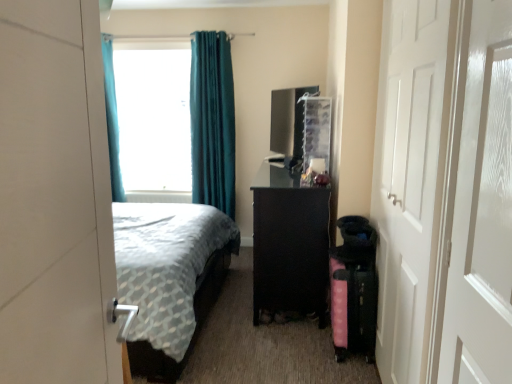
Describe the element at coordinates (154, 118) in the screenshot. I see `blue fabric curtain at upper center` at that location.

Find the location of a particular element. transparent frosted glass screen door at right is located at coordinates (482, 228).

The width and height of the screenshot is (512, 384). What are the coordinates of `teal velvet curtain at upper center, the 1th curtain viewed from the right` in the screenshot? It's located at (212, 121).

Image resolution: width=512 pixels, height=384 pixels. Describe the element at coordinates (444, 192) in the screenshot. I see `white matte door at right, which ranks as the 1th door in right-to-left order` at that location.

What is the approximate width of white glossy door at left, acting as the 2th door starting from the back?

The width of white glossy door at left, acting as the 2th door starting from the back, is 4.57 inches.

The height and width of the screenshot is (384, 512). I want to click on blue fabric curtain at upper center, so click(x=154, y=118).

From a real-world perspective, between pink fabric suitcase at lower right and blue fabric curtain at upper center, who is vertically lower?

From a 3D spatial view, pink fabric suitcase at lower right is below.

At what (x,y) coordinates should I click in order to perform the action: click on luggage located below the blue fabric curtain at upper center (from the image's perspective). Please return your answer as a coordinate pair (x, y). Looking at the image, I should click on (353, 301).

Which object is closer to the camera taking this photo, pink fabric suitcase at lower right or blue fabric curtain at upper center?

pink fabric suitcase at lower right is closer to the camera.

Which point is more forward, (369, 259) or (125, 139)?

The point (369, 259) is more forward.

Can you confirm if black glossy vanity at center is taller than transparent frosted glass screen door at right?

No.

From the image's perspective, which one is positioned higher, black glossy vanity at center or transparent frosted glass screen door at right?

From the image's view, transparent frosted glass screen door at right is above.

Image resolution: width=512 pixels, height=384 pixels. There is a black glossy vanity at center. Identify the location of screen door above it (from a real-world perspective). (482, 228).

How many degrees apart are the facing directions of black glossy vanity at center and transparent frosted glass screen door at right?

The facing directions of black glossy vanity at center and transparent frosted glass screen door at right are 0.765 degrees apart.

Is teal fabric curtain at left, the second curtain when ordered from right to left, further to camera compared to white glossy door at left, which appears as the 1th door when viewed from the left?

Yes, teal fabric curtain at left, the second curtain when ordered from right to left, is behind white glossy door at left, which appears as the 1th door when viewed from the left.

Is teal fabric curtain at left, the second curtain when ordered from right to left, taller than white glossy door at left, acting as the 2th door starting from the back?

Yes, teal fabric curtain at left, the second curtain when ordered from right to left, is taller than white glossy door at left, acting as the 2th door starting from the back.

Who is bigger, teal fabric curtain at left, the second curtain when ordered from right to left, or white glossy door at left, acting as the 2th door starting from the back?

Bigger between the two is teal fabric curtain at left, the second curtain when ordered from right to left.

From the image's perspective, which one is positioned lower, teal fabric curtain at left, the second curtain when ordered from right to left, or white glossy door at left, which appears as the first door when viewed from the front?

From the image's view, white glossy door at left, which appears as the first door when viewed from the front, is below.

Is blue fabric curtain at upper center situated inside transparent frosted glass screen door at right or outside?

blue fabric curtain at upper center is not inside transparent frosted glass screen door at right, it's outside.

What's the angular difference between blue fabric curtain at upper center and transparent frosted glass screen door at right's facing directions?

90.1 degrees separate the facing orientations of blue fabric curtain at upper center and transparent frosted glass screen door at right.

Is transparent frosted glass screen door at right at the back of blue fabric curtain at upper center?

No, blue fabric curtain at upper center's orientation is not away from transparent frosted glass screen door at right.

Can you confirm if blue fabric curtain at upper center is thinner than teal velvet curtain at upper center, which is the 2th curtain from left to right?

No.

Are blue fabric curtain at upper center and teal velvet curtain at upper center, which is the 2th curtain from left to right, far apart?

No, there isn't a large distance between blue fabric curtain at upper center and teal velvet curtain at upper center, which is the 2th curtain from left to right.

Does blue fabric curtain at upper center turn towards teal velvet curtain at upper center, the 1th curtain viewed from the right?

No, blue fabric curtain at upper center does not turn towards teal velvet curtain at upper center, the 1th curtain viewed from the right.

Does transparent frosted glass screen door at right turn towards blue fabric curtain at upper center?

No, transparent frosted glass screen door at right is not turned towards blue fabric curtain at upper center.

Identify the location of screen door below the blue fabric curtain at upper center (from the image's perspective). click(482, 228).

Does transparent frosted glass screen door at right have a smaller size compared to blue fabric curtain at upper center?

Yes, transparent frosted glass screen door at right is smaller than blue fabric curtain at upper center.

Which is behind, point (507, 349) or point (336, 324)?

The point (336, 324) is more distant.

Who is bigger, transparent frosted glass screen door at right or pink fabric suitcase at lower right?

pink fabric suitcase at lower right is bigger.

How different are the orientations of transparent frosted glass screen door at right and pink fabric suitcase at lower right in degrees?

There is a 1.12-degree angle between the facing directions of transparent frosted glass screen door at right and pink fabric suitcase at lower right.

Which object is further away from the camera taking this photo, transparent frosted glass screen door at right or pink fabric suitcase at lower right?

pink fabric suitcase at lower right is further from the camera.

Identify the location of luggage lying on the right of blue fabric curtain at upper center. (353, 301).

Find the location of a particular element. screen door in front of the black glossy vanity at center is located at coordinates (482, 228).

In the scene shown: Based on their spatial positions, is white glossy door at left, acting as the 2th door starting from the back, or transparent frosted glass screen door at right closer to pink fabric suitcase at lower right?

The object closer to pink fabric suitcase at lower right is transparent frosted glass screen door at right.

Considering their positions, is white glossy door at left, acting as the 2th door starting from the back, positioned closer to blue fabric curtain at upper center than black glossy vanity at center?

Based on the image, black glossy vanity at center appears to be nearer to blue fabric curtain at upper center.

When comparing their distances from teal fabric curtain at left, placed as the first curtain when sorted from left to right, does black glossy vanity at center or white matte door at right, which ranks as the 1th door in right-to-left order, seem closer?

black glossy vanity at center lies closer to teal fabric curtain at left, placed as the first curtain when sorted from left to right, than the other object.

Consider the image. From the image, which object appears to be nearer to transparent frosted glass screen door at right, teal fabric curtain at left, placed as the first curtain when sorted from left to right, or teal velvet curtain at upper center, which is the 2th curtain from left to right?

Based on the image, teal velvet curtain at upper center, which is the 2th curtain from left to right, appears to be nearer to transparent frosted glass screen door at right.

Considering their positions, is transparent frosted glass screen door at right positioned further to teal fabric curtain at left, the second curtain when ordered from right to left, than white glossy door at left, which appears as the first door when viewed from the front?

transparent frosted glass screen door at right is positioned further to the anchor teal fabric curtain at left, the second curtain when ordered from right to left.

Based on their spatial positions, is black glossy vanity at center or white glossy door at left, which appears as the first door when viewed from the front, closer to blue fabric curtain at upper center?

Among the two, black glossy vanity at center is located nearer to blue fabric curtain at upper center.

Estimate the real-world distances between objects in this image. Which object is closer to teal velvet curtain at upper center, the 1th curtain viewed from the right, transparent frosted glass screen door at right or blue fabric curtain at upper center?

Based on the image, blue fabric curtain at upper center appears to be nearer to teal velvet curtain at upper center, the 1th curtain viewed from the right.

Considering their positions, is teal velvet curtain at upper center, the 1th curtain viewed from the right, positioned closer to pink fabric suitcase at lower right than white matte door at right, which ranks as the 1th door in right-to-left order?

Among the two, white matte door at right, which ranks as the 1th door in right-to-left order, is located nearer to pink fabric suitcase at lower right.

The height and width of the screenshot is (384, 512). Find the location of `luggage between transparent frosted glass screen door at right and blue fabric curtain at upper center from front to back`. luggage between transparent frosted glass screen door at right and blue fabric curtain at upper center from front to back is located at coordinates (353, 301).

You are a GUI agent. You are given a task and a screenshot of the screen. Output one action in this format:
    pyautogui.click(x=<x>, y=<y>)
    Task: Click on the door between white glossy door at left, acting as the 2th door starting from the back, and pink fabric suitcase at lower right in the front-back direction
    
    Given the screenshot: What is the action you would take?
    pyautogui.click(x=444, y=192)

Identify the location of vanity between white matte door at right, positioned as the second door in left-to-right order, and teal velvet curtain at upper center, the 1th curtain viewed from the right, in the front-back direction. The image size is (512, 384). (289, 246).

Image resolution: width=512 pixels, height=384 pixels. I want to click on luggage positioned between white matte door at right, positioned as the second door in left-to-right order, and blue fabric curtain at upper center from near to far, so click(353, 301).